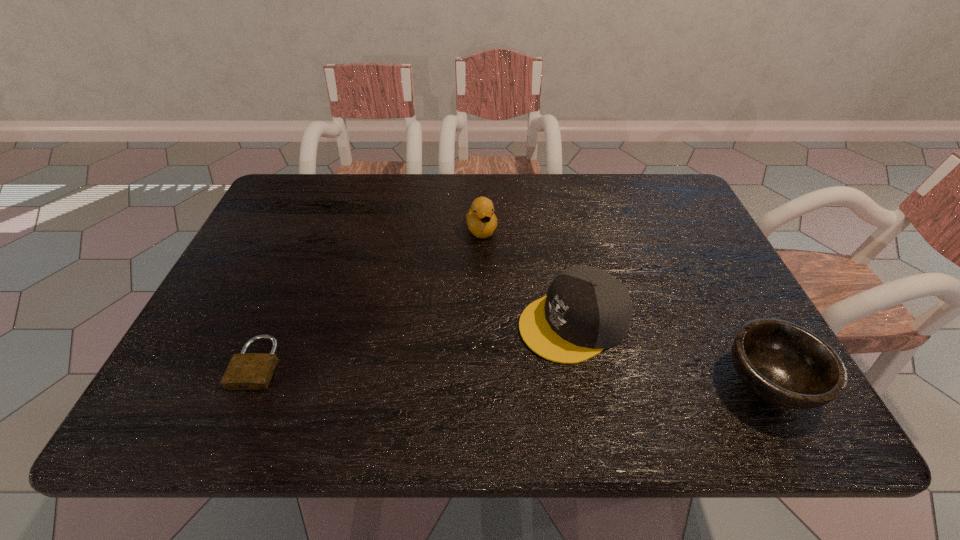
Where is `free space located 0.070m on the face of the duckling`? This screenshot has height=540, width=960. free space located 0.070m on the face of the duckling is located at coordinates (490, 262).

Where is `free space located 0.230m on the front-facing side of the third object from left to right`? free space located 0.230m on the front-facing side of the third object from left to right is located at coordinates (429, 386).

This screenshot has height=540, width=960. Find the location of `free space located on the front-facing side of the third object from left to right`. free space located on the front-facing side of the third object from left to right is located at coordinates (478, 364).

Identify the location of free space located on the front-facing side of the third object from left to right. The image size is (960, 540). (473, 366).

At what (x,y) coordinates should I click in order to perform the action: click on object located at the far edge. Please return your answer as a coordinate pair (x, y). Looking at the image, I should click on click(x=481, y=220).

You are a GUI agent. You are given a task and a screenshot of the screen. Output one action in this format:
    pyautogui.click(x=<x>, y=<y>)
    Task: Click on the padlock that is at the near edge
    The height and width of the screenshot is (540, 960).
    Given the screenshot: What is the action you would take?
    pyautogui.click(x=246, y=371)

At what (x,y) coordinates should I click in order to perform the action: click on bowl that is at the near edge. Please return your answer as a coordinate pair (x, y). Image resolution: width=960 pixels, height=540 pixels. Looking at the image, I should click on [785, 364].

The image size is (960, 540). Identify the location of cap that is at the near edge. (586, 310).

Find the location of a particular element. object present at the left edge is located at coordinates (246, 371).

At what (x,y) coordinates should I click in order to perform the action: click on object located at the right edge. Please return your answer as a coordinate pair (x, y). Image resolution: width=960 pixels, height=540 pixels. Looking at the image, I should click on (785, 364).